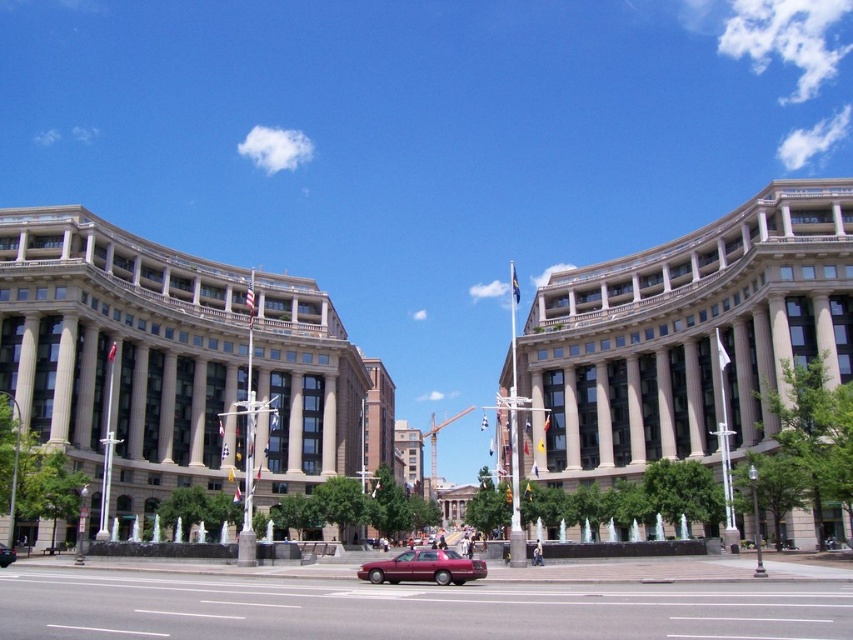
Does shiny maroon sedan at center have a greater height compared to metallic red car at center?

In fact, shiny maroon sedan at center may be shorter than metallic red car at center.

Which is above, shiny maroon sedan at center or metallic red car at center?

shiny maroon sedan at center is above.

What are the coordinates of `shiny maroon sedan at center` in the screenshot? It's located at (422, 566).